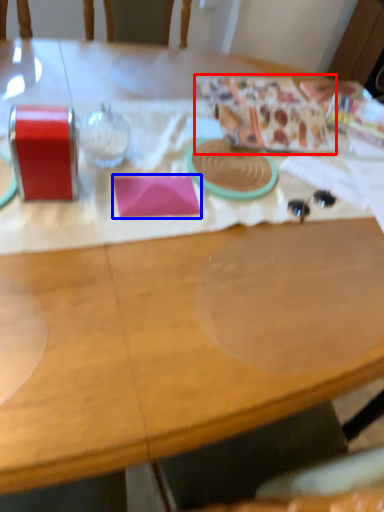
Question: Which object appears closest to the camera in this image, wrapping paper (highlighted by a red box) or notepad (highlighted by a blue box)?

Choices:
 (A) wrapping paper
 (B) notepad

Answer: (B)